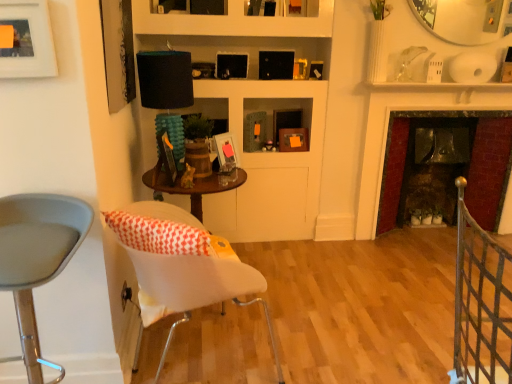
What do you see at coordinates (182, 265) in the screenshot? I see `white plastic chair at center, marked as the second chair in a left-to-right arrangement` at bounding box center [182, 265].

Identify the location of black fabric lampshade at upper center. The image size is (512, 384). (165, 79).

What is the approximate width of dark red brick fireplace at right?

The width of dark red brick fireplace at right is 3.37 inches.

This screenshot has width=512, height=384. In order to click on matte white picture frame at upper left, positioned as the 1th picture frame in left-to-right order in this screenshot , I will do `click(26, 40)`.

Measure the distance between point (114, 37) and camera.

Point (114, 37) is 6.10 feet from camera.

The height and width of the screenshot is (384, 512). I want to click on matte black picture frame at upper left, which ranks as the 2th picture frame in left-to-right order, so click(x=118, y=52).

What is the approximate width of gray plastic stool at left, arranged as the second chair when viewed from the right?

gray plastic stool at left, arranged as the second chair when viewed from the right, is 16.74 inches in width.

Find the location of a particular element. woodenmaterial/texturebookshelf at upper center is located at coordinates click(254, 110).

Identify the location of white plastic chair at center, marked as the second chair in a left-to-right arrangement. Image resolution: width=512 pixels, height=384 pixels. (182, 265).

From the image's perspective, is black fabric lampshade at upper center located above or below dark red brick fireplace at right?

black fabric lampshade at upper center is situated higher than dark red brick fireplace at right in the image.

Between point (176, 56) and point (423, 170), which one is positioned in front?

The point (176, 56) is closer to the camera.

Is black fabric lampshade at upper center positioned with its back to dark red brick fireplace at right?

black fabric lampshade at upper center does not have its back to dark red brick fireplace at right.

Can you tell me how much black fabric lampshade at upper center and dark red brick fireplace at right differ in facing direction?

There is a 87.1-degree angle between the facing directions of black fabric lampshade at upper center and dark red brick fireplace at right.

Which point is more forward, [225,224] or [250,289]?

The point [250,289] is in front.

From a real-world perspective, between woodenmaterial/texturebookshelf at upper center and white plastic chair at center, marked as the second chair in a left-to-right arrangement, who is vertically lower?

In real-world perspective, white plastic chair at center, marked as the second chair in a left-to-right arrangement, is lower.

Can you see woodenmaterial/texturebookshelf at upper center touching white plastic chair at center, marked as the second chair in a left-to-right arrangement?

woodenmaterial/texturebookshelf at upper center and white plastic chair at center, marked as the second chair in a left-to-right arrangement, are clearly separated.

Between woodenmaterial/texturebookshelf at upper center and white plastic chair at center, the first chair from the right, which one has less height?

white plastic chair at center, the first chair from the right.

Which is closer to the camera, (138,281) or (217,157)?

Point (138,281) is closer to the camera than point (217,157).

You are a GUI agent. You are given a task and a screenshot of the screen. Output one action in this format:
    pyautogui.click(x=<x>, y=<y>)
    Task: Click on the picture frame that is the 1st object to the right of the white plastic chair at center, the first chair from the right, starting at the anchor
    This screenshot has width=512, height=384.
    Given the screenshot: What is the action you would take?
    pyautogui.click(x=225, y=152)

Considering the relative sizes of white plastic chair at center, the first chair from the right, and matte wooden picture frame at center, which is the fourth picture frame in front-to-back order, in the image provided, is white plastic chair at center, the first chair from the right, thinner than matte wooden picture frame at center, which is the fourth picture frame in front-to-back order,?

No.

Would you consider white plastic chair at center, the first chair from the right, to be distant from matte wooden picture frame at center, positioned as the second picture frame in back-to-front order?

That's not correct — white plastic chair at center, the first chair from the right, is a little close to matte wooden picture frame at center, positioned as the second picture frame in back-to-front order.

Looking at the image, does wooden picture frame at center, the 3th picture frame from the right, seem bigger or smaller compared to white plastic chair at center, marked as the second chair in a left-to-right arrangement?

wooden picture frame at center, the 3th picture frame from the right, is smaller than white plastic chair at center, marked as the second chair in a left-to-right arrangement.

Which of these two, wooden picture frame at center, positioned as the 3th picture frame in front-to-back order, or white plastic chair at center, marked as the second chair in a left-to-right arrangement, is thinner?

wooden picture frame at center, positioned as the 3th picture frame in front-to-back order, is thinner.

The width and height of the screenshot is (512, 384). I want to click on the 2nd chair located beneath the wooden picture frame at center, placed as the third picture frame when sorted from left to right (from a real-world perspective), so click(182, 265).

Is point (172, 179) positioned after point (142, 251)?

Yes, it is.

Considering the sizes of black fabric lampshade at upper center and matte black picture frame at upper center, the fifth picture frame in the front-to-back sequence, in the image, is black fabric lampshade at upper center wider or thinner than matte black picture frame at upper center, the fifth picture frame in the front-to-back sequence,?

In the image, black fabric lampshade at upper center appears to be wider than matte black picture frame at upper center, the fifth picture frame in the front-to-back sequence.

Is black fabric lampshade at upper center turned away from matte black picture frame at upper center, the first picture frame viewed from the back?

No, matte black picture frame at upper center, the first picture frame viewed from the back, is not at the back of black fabric lampshade at upper center.

From the image's perspective, is black fabric lampshade at upper center under matte black picture frame at upper center, the fifth picture frame in the front-to-back sequence?

No, from the image's perspective, black fabric lampshade at upper center is not below matte black picture frame at upper center, the fifth picture frame in the front-to-back sequence.

In order to click on the 3rd picture frame positioned below the black fabric lampshade at upper center (from a real-world perspective) in this screenshot , I will do `click(293, 140)`.

From a real-world perspective, is black metal gate at lower right positioned above or below dark red brick fireplace at right?

In terms of real-world spatial position, black metal gate at lower right is above dark red brick fireplace at right.

From the image's perspective, which object appears higher, black metal gate at lower right or dark red brick fireplace at right?

dark red brick fireplace at right is shown above in the image.

Which point is more distant from viewer, (x=505, y=298) or (x=453, y=182)?

Point (x=453, y=182)

Between black metal gate at lower right and dark red brick fireplace at right, which one has smaller size?

dark red brick fireplace at right is smaller.

Would you say wooden picture frame at center, the 3th picture frame from the right, is inside or outside gray plastic stool at left, acting as the 1th chair starting from the left?

wooden picture frame at center, the 3th picture frame from the right, lies outside gray plastic stool at left, acting as the 1th chair starting from the left.

From the image's perspective, which one is positioned higher, wooden picture frame at center, the 3th picture frame from the right, or gray plastic stool at left, acting as the 1th chair starting from the left?

From the image's view, wooden picture frame at center, the 3th picture frame from the right, is above.

From a real-world perspective, is wooden picture frame at center, the 3th picture frame from the right, positioned over gray plastic stool at left, acting as the 1th chair starting from the left, based on gravity?

Yes, from a real-world perspective, wooden picture frame at center, the 3th picture frame from the right, is over gray plastic stool at left, acting as the 1th chair starting from the left

Find the location of a particular element. Image resolution: width=512 pixels, height=384 pixels. lamp that appears in front of the dark red brick fireplace at right is located at coordinates (165, 79).

This screenshot has height=384, width=512. I want to click on bookshelf that is above the white plastic chair at center, marked as the second chair in a left-to-right arrangement (from a real-world perspective), so click(254, 110).

Looking at the image, which one is located further to black fabric lampshade at upper center, matte wooden picture frame at center, the 4th picture frame viewed from the left, or matte white picture frame at upper left, which ranks as the fifth picture frame in right-to-left order?

matte white picture frame at upper left, which ranks as the fifth picture frame in right-to-left order, is further to black fabric lampshade at upper center.

From the picture: When comparing their distances from matte black picture frame at upper center, the first picture frame viewed from the back, does matte white picture frame at upper left, positioned as the 1th picture frame in left-to-right order, or dark red brick fireplace at right seem closer?

dark red brick fireplace at right is positioned closer to the anchor matte black picture frame at upper center, the first picture frame viewed from the back.

Estimate the real-world distances between objects in this image. Which object is closer to wooden picture frame at center, placed as the third picture frame when sorted from left to right, dark red brick fireplace at right or matte wooden picture frame at center, positioned as the second picture frame in back-to-front order?

matte wooden picture frame at center, positioned as the second picture frame in back-to-front order, lies closer to wooden picture frame at center, placed as the third picture frame when sorted from left to right, than the other object.

When comparing their distances from matte black picture frame at upper center, the fifth picture frame in the front-to-back sequence, does dark red brick fireplace at right or white plastic chair at center, the first chair from the right, seem further?

white plastic chair at center, the first chair from the right, lies further to matte black picture frame at upper center, the fifth picture frame in the front-to-back sequence, than the other object.

When comparing their distances from wooden picture frame at center, positioned as the 3th picture frame in front-to-back order, does matte white picture frame at upper left, which ranks as the fifth picture frame in right-to-left order, or woodenmaterial/texturebookshelf at upper center seem further?

matte white picture frame at upper left, which ranks as the fifth picture frame in right-to-left order.

From the picture: Considering their positions, is wooden picture frame at center, the 3th picture frame from the right, positioned closer to matte wooden picture frame at center, arranged as the 2th picture frame when viewed from the right, than gray plastic stool at left, acting as the 1th chair starting from the left?

wooden picture frame at center, the 3th picture frame from the right, lies closer to matte wooden picture frame at center, arranged as the 2th picture frame when viewed from the right, than the other object.

Considering their positions, is matte white picture frame at upper left, placed as the 5th picture frame when sorted from back to front, positioned further to matte wooden picture frame at center, the 4th picture frame viewed from the left, than dark red brick fireplace at right?

dark red brick fireplace at right.

Considering their positions, is gray plastic stool at left, arranged as the second chair when viewed from the right, positioned closer to wooden picture frame at center, placed as the third picture frame when sorted from left to right, than matte black picture frame at upper center, the first picture frame viewed from the back?

gray plastic stool at left, arranged as the second chair when viewed from the right.

You are a GUI agent. You are given a task and a screenshot of the screen. Output one action in this format:
    pyautogui.click(x=<x>, y=<y>)
    Task: Click on the bookshelf situated between matte black picture frame at upper left, which is the fourth picture frame in back-to-front order, and dark red brick fireplace at right from left to right
    This screenshot has width=512, height=384.
    Given the screenshot: What is the action you would take?
    pyautogui.click(x=254, y=110)

The height and width of the screenshot is (384, 512). I want to click on lamp between gray plastic stool at left, arranged as the second chair when viewed from the right, and matte black picture frame at upper center, marked as the 5th picture frame in a left-to-right arrangement, from front to back, so click(x=165, y=79).

The image size is (512, 384). Identify the location of fireplace positioned between black metal gate at lower right and matte black picture frame at upper center, marked as the 5th picture frame in a left-to-right arrangement, from near to far. (446, 171).

Locate an element on the screen. lamp positioned between white plastic chair at center, the first chair from the right, and woodenmaterial/texturebookshelf at upper center from near to far is located at coordinates (165, 79).